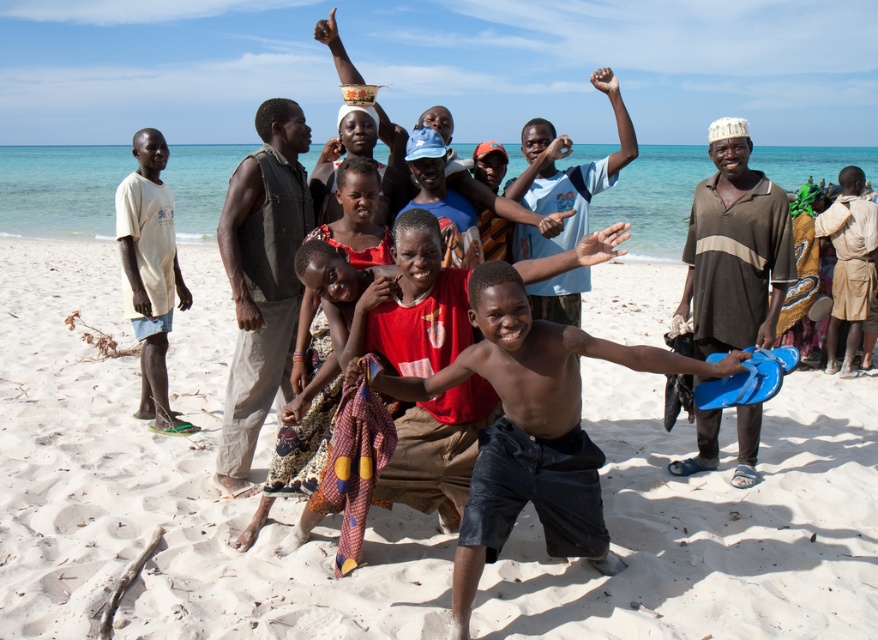
Locate an element on the screen. This screenshot has height=640, width=878. brown striped shirt at right is located at coordinates (735, 248).

Locate an element on the screen. The width and height of the screenshot is (878, 640). brown striped shirt at right is located at coordinates (735, 248).

Where is `brown striped shirt at right`? The height and width of the screenshot is (640, 878). brown striped shirt at right is located at coordinates (735, 248).

Is dark brown cotton vest at center to the left of brown fabric at right from the viewer's perspective?

Yes, dark brown cotton vest at center is to the left of brown fabric at right.

In the scene shown: Can you confirm if dark brown cotton vest at center is thinner than brown fabric at right?

Yes, dark brown cotton vest at center is thinner than brown fabric at right.

In order to click on dark brown cotton vest at center in this screenshot , I will do `click(261, 280)`.

Between white sand at center and light yellow t-shirt at left, which one is positioned lower?

white sand at center is below.

What are the coordinates of `white sand at center` in the screenshot? It's located at (163, 483).